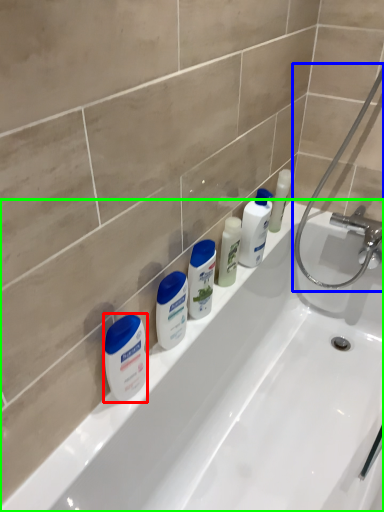
Question: Which object is the farthest from cleaning product (highlighted by a red box)? Choose among these: shower (highlighted by a blue box) or bathtub (highlighted by a green box).

Choices:
 (A) shower
 (B) bathtub

Answer: (A)